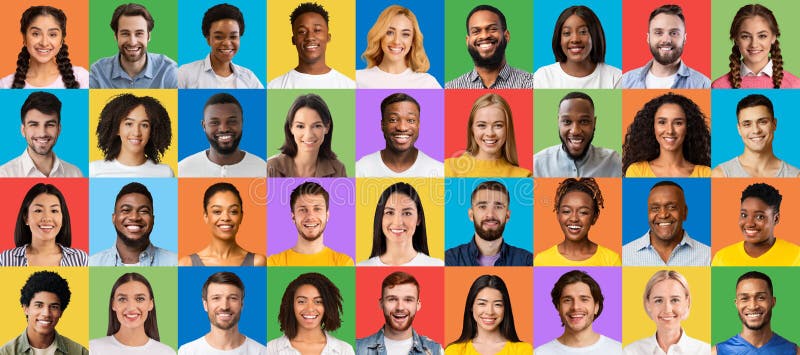
You are a GUI agent. You are given a task and a screenshot of the screen. Output one action in this format:
    pyautogui.click(x=<x>, y=<y>)
    Task: Click on the pictures in 3rd row from top
    
    Given the screenshot: What is the action you would take?
    pyautogui.click(x=50, y=219), pyautogui.click(x=126, y=216), pyautogui.click(x=226, y=222), pyautogui.click(x=308, y=223), pyautogui.click(x=397, y=219), pyautogui.click(x=494, y=223), pyautogui.click(x=573, y=219), pyautogui.click(x=661, y=224), pyautogui.click(x=750, y=219)